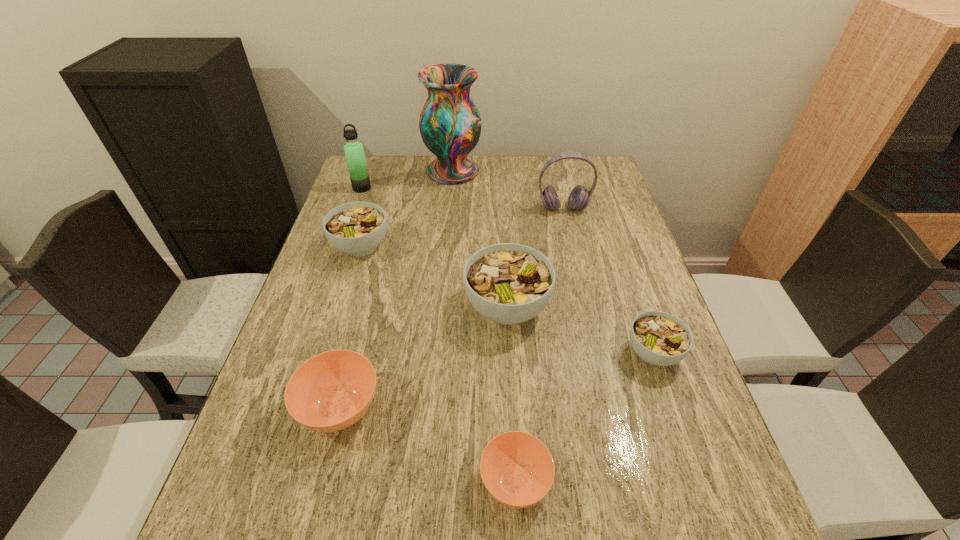
Where is `vacant space at the far left corner`? The image size is (960, 540). vacant space at the far left corner is located at coordinates (396, 185).

This screenshot has height=540, width=960. In the image, there is a desktop. Identify the location of free space at the far right corner. (600, 170).

The width and height of the screenshot is (960, 540). Identify the location of unoccupied area between the tallest object and the third tallest object. (508, 190).

The image size is (960, 540). Identify the location of free spot between the smaller peach soup bowl and the second biggest white soup bowl. (438, 363).

Locate an element on the screen. free space between the sixth shortest object and the rightmost white soup bowl is located at coordinates (609, 280).

At what (x,y) coordinates should I click in order to perform the action: click on free spot between the third tallest object and the left peach soup bowl. Please return your answer as a coordinate pair (x, y). This screenshot has width=960, height=540. Looking at the image, I should click on (452, 308).

Identify the location of unoccupied area between the fourth tallest object and the rightmost soup bowl. (580, 330).

This screenshot has width=960, height=540. What are the coordinates of `free space between the smaller peach soup bowl and the thermos bottle` in the screenshot? It's located at (439, 334).

Locate an element on the screen. vacant area between the farthest white soup bowl and the right peach soup bowl is located at coordinates (438, 363).

You are a GUI agent. You are given a task and a screenshot of the screen. Output one action in this format:
    pyautogui.click(x=<x>, y=<y>)
    Task: Click on the unoccupied area between the rightmost soup bowl and the biggest white soup bowl
    The height and width of the screenshot is (540, 960).
    Given the screenshot: What is the action you would take?
    pyautogui.click(x=580, y=330)